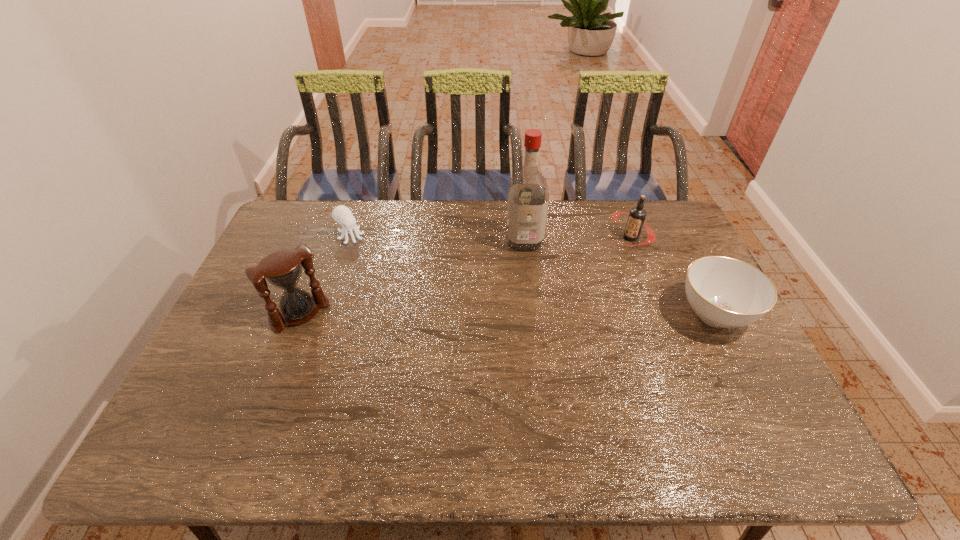
Where is `vacant space located on the label of the root beer`? The image size is (960, 540). vacant space located on the label of the root beer is located at coordinates (575, 273).

At what (x,y) coordinates should I click in order to perform the action: click on vacant space located 0.170m on the front-facing side of the liquor. Please return your answer as a coordinate pair (x, y). This screenshot has width=960, height=540. Looking at the image, I should click on (531, 289).

This screenshot has height=540, width=960. Identify the location of vacant area located on the front-facing side of the liquor. (538, 342).

Where is `vacant position located on the front-facing side of the liquor`? The height and width of the screenshot is (540, 960). vacant position located on the front-facing side of the liquor is located at coordinates (535, 319).

Locate an element on the screen. vacant position located on the front-facing side of the octopus is located at coordinates (393, 266).

Where is `vacant space located 0.360m on the front-facing side of the octopus`? vacant space located 0.360m on the front-facing side of the octopus is located at coordinates (431, 293).

In order to click on free space located on the front-facing side of the octopus in this screenshot , I will do `click(381, 258)`.

This screenshot has height=540, width=960. I want to click on root beer located in the far edge section of the desktop, so tap(637, 215).

Locate an element on the screen. The image size is (960, 540). liquor that is at the far edge is located at coordinates (528, 196).

Find the location of `octopus present at the far edge`. octopus present at the far edge is located at coordinates (341, 214).